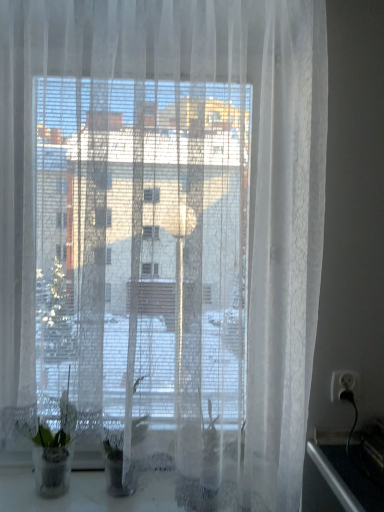
This screenshot has height=512, width=384. What are the coordinates of `vacant location below green matte plant at lower left (from a real-world perspective)` in the screenshot? It's located at (47, 494).